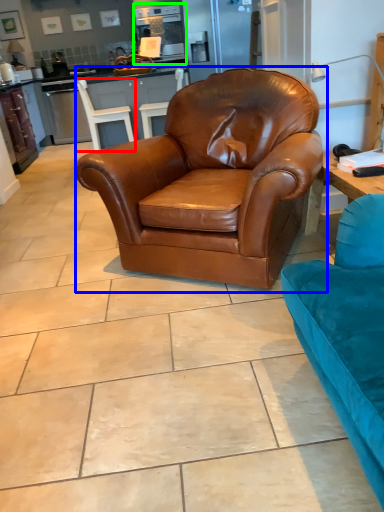
Question: Considering the real-world distances, which object is closest to chair (highlighted by a red box)? chair (highlighted by a blue box) or appliance (highlighted by a green box).

Choices:
 (A) chair
 (B) appliance

Answer: (B)